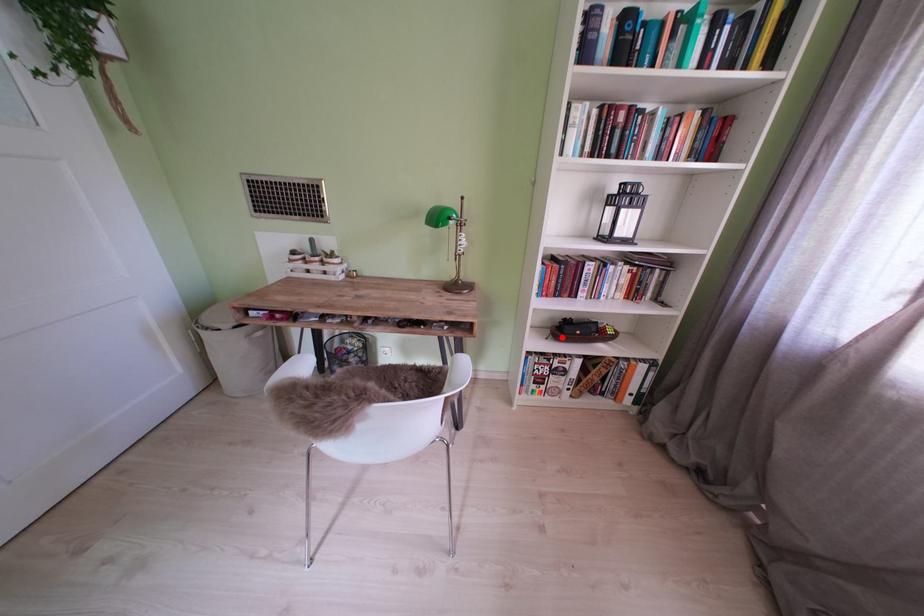
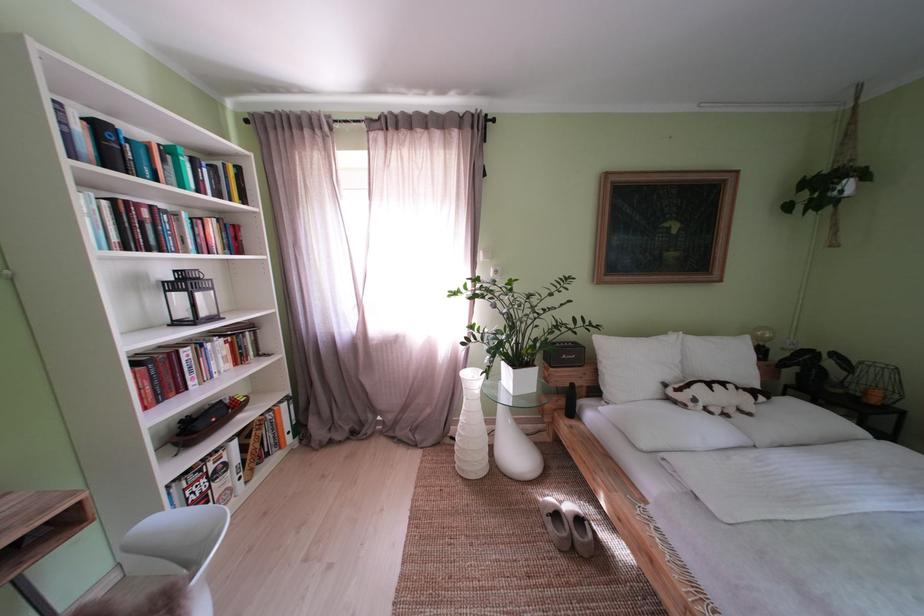
Question: I am providing you with two images of the same scene from different viewpoints. A red point is marked on the first image. Can you still see the location of the red point in image 2?

Choices:
 (A) Yes
 (B) No

Answer: (A)